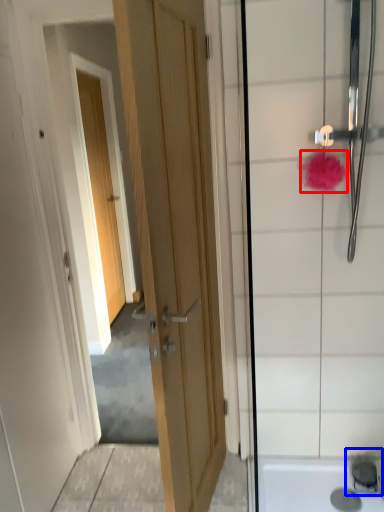
Question: Which object appears closest to the camera in this image, flower (highlighted by a red box) or faucet (highlighted by a blue box)?

Choices:
 (A) flower
 (B) faucet

Answer: (A)